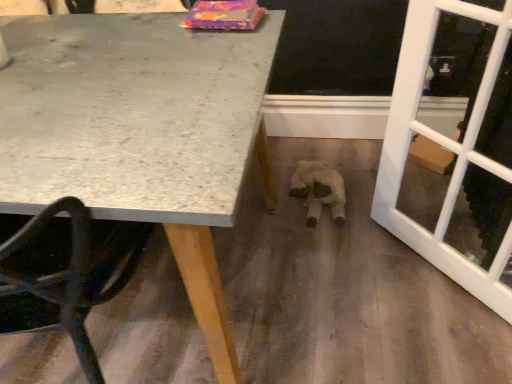
The height and width of the screenshot is (384, 512). Describe the element at coordinates (444, 146) in the screenshot. I see `white glass screen door at right` at that location.

Where is `granite table at upper left`? The width and height of the screenshot is (512, 384). granite table at upper left is located at coordinates (140, 133).

Between point (457, 277) and point (328, 183), which one is positioned behind?

The point (328, 183) is behind.

Consider the image. From the image's perspective, does white glass screen door at right appear higher than white plush toy at center?

Yes.

Looking at this image, in the image, is granite table at upper left on the left side or the right side of white glass screen door at right?

Based on their positions, granite table at upper left is located to the left of white glass screen door at right.

Looking at this image, considering the relative positions of granite table at upper left and white glass screen door at right in the image provided, is granite table at upper left behind white glass screen door at right?

No, granite table at upper left is closer to the camera.

This screenshot has width=512, height=384. I want to click on screen door above the granite table at upper left (from the image's perspective), so click(x=444, y=146).

Does white plush toy at center have a greater height compared to granite table at upper left?

No, white plush toy at center is not taller than granite table at upper left.

Would you say white plush toy at center is a long distance from granite table at upper left?

No, white plush toy at center is not far away from granite table at upper left.

From a real-world perspective, who is located lower, white plush toy at center or granite table at upper left?

From a 3D spatial view, white plush toy at center is below.

Which is in front, point (387, 155) or point (69, 21)?

The point (69, 21) is closer to the camera.

From the image's perspective, is white glass screen door at right positioned above or below granite table at upper left?

Clearly, from the image's perspective, white glass screen door at right is above granite table at upper left.

Considering the sizes of objects white glass screen door at right and granite table at upper left in the image provided, who is taller, white glass screen door at right or granite table at upper left?

white glass screen door at right is taller.

Can you confirm if white glass screen door at right is smaller than granite table at upper left?

Correct, white glass screen door at right occupies less space than granite table at upper left.

From the image's perspective, which is above, white plush toy at center or white glass screen door at right?

white glass screen door at right.

In terms of size, does white plush toy at center appear bigger or smaller than white glass screen door at right?

Clearly, white plush toy at center is smaller in size than white glass screen door at right.

The height and width of the screenshot is (384, 512). What are the coordinates of `animal that is below the white glass screen door at right (from the image's perspective)` in the screenshot? It's located at (319, 190).

Is white plush toy at center looking in the opposite direction of white glass screen door at right?

No, white plush toy at center is not facing the opposite direction of white glass screen door at right.

Is granite table at upper left not near white plush toy at center?

No, there isn't a large distance between granite table at upper left and white plush toy at center.

From the image's perspective, which object appears higher, granite table at upper left or white plush toy at center?

From the image's view, white plush toy at center is above.

From a real-world perspective, is granite table at upper left beneath white plush toy at center?

No, from a real-world perspective, granite table at upper left is not below white plush toy at center.

Identify the location of table to the left of white plush toy at center. This screenshot has height=384, width=512. (140, 133).

I want to click on animal on the left of white glass screen door at right, so click(x=319, y=190).

Where is `table beneath the white glass screen door at right (from a real-world perspective)`? The height and width of the screenshot is (384, 512). table beneath the white glass screen door at right (from a real-world perspective) is located at coordinates (140, 133).

When comparing their distances from white plush toy at center, does white glass screen door at right or granite table at upper left seem closer?

white glass screen door at right is closer to white plush toy at center.

Considering their positions, is granite table at upper left positioned further to white glass screen door at right than white plush toy at center?

granite table at upper left.

Considering their positions, is white plush toy at center positioned further to granite table at upper left than white glass screen door at right?

white plush toy at center is positioned further to the anchor granite table at upper left.

Which object lies further to the anchor point granite table at upper left, white glass screen door at right or white plush toy at center?

white plush toy at center is positioned further to the anchor granite table at upper left.

Estimate the real-world distances between objects in this image. Which object is closer to white plush toy at center, granite table at upper left or white glass screen door at right?

Based on the image, white glass screen door at right appears to be nearer to white plush toy at center.

Considering their positions, is white plush toy at center positioned closer to white glass screen door at right than granite table at upper left?

Based on the image, white plush toy at center appears to be nearer to white glass screen door at right.

The width and height of the screenshot is (512, 384). I want to click on animal located between granite table at upper left and white glass screen door at right in the left-right direction, so click(x=319, y=190).